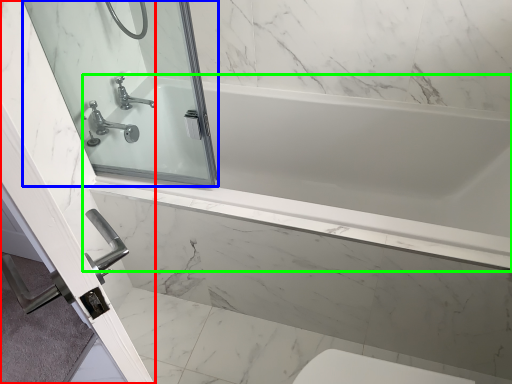
Question: Which is farther away from screen door (highlighted by a red box)? mirror (highlighted by a blue box) or bathtub (highlighted by a green box)?

Choices:
 (A) mirror
 (B) bathtub

Answer: (B)